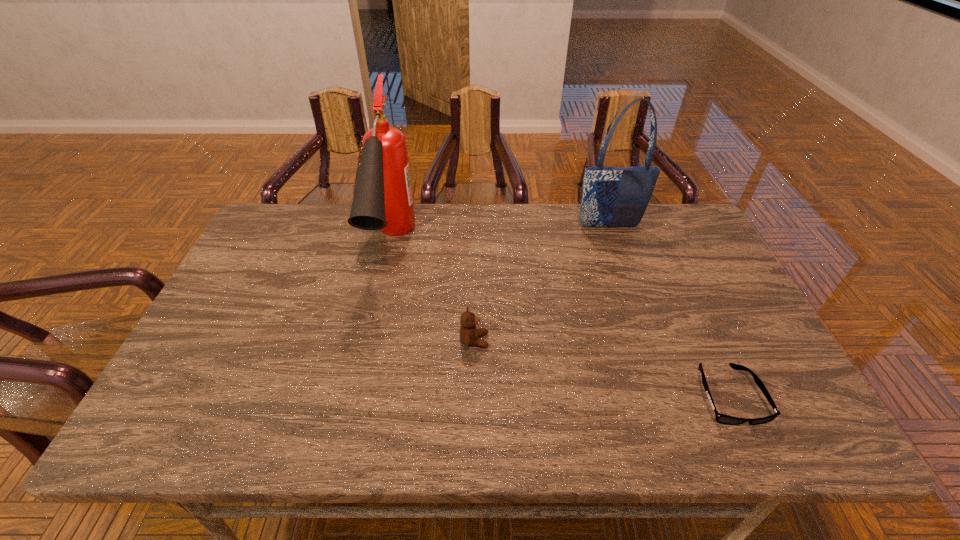
Where is `the leftmost object`? The height and width of the screenshot is (540, 960). the leftmost object is located at coordinates (382, 200).

Where is `shopping bag`? This screenshot has width=960, height=540. shopping bag is located at coordinates pyautogui.click(x=612, y=197).

You are a GUI agent. You are given a task and a screenshot of the screen. Output one action in this format:
    pyautogui.click(x=<x>, y=<y>)
    Task: Click on the teddy bear
    Image resolution: width=960 pixels, height=540 pixels.
    Given the screenshot: What is the action you would take?
    pyautogui.click(x=469, y=334)

This screenshot has height=540, width=960. What are the coordinates of `the second object from left to right` in the screenshot? It's located at (469, 334).

Find the location of a particular element. sunglasses is located at coordinates (720, 418).

Locate an element on the screen. the shortest object is located at coordinates (720, 418).

Find the location of a particular element. This screenshot has width=960, height=540. vacant space situated at the nozzle of the fire extinguisher is located at coordinates (369, 357).

Image resolution: width=960 pixels, height=540 pixels. I want to click on vacant space located 0.310m on the front-facing side of the shopping bag, so click(635, 301).

Where is `vacant region located at the face of the second nearest object`? The width and height of the screenshot is (960, 540). vacant region located at the face of the second nearest object is located at coordinates (647, 341).

Find the location of a particular element. This screenshot has height=540, width=960. fire extinguisher that is at the far edge is located at coordinates (382, 200).